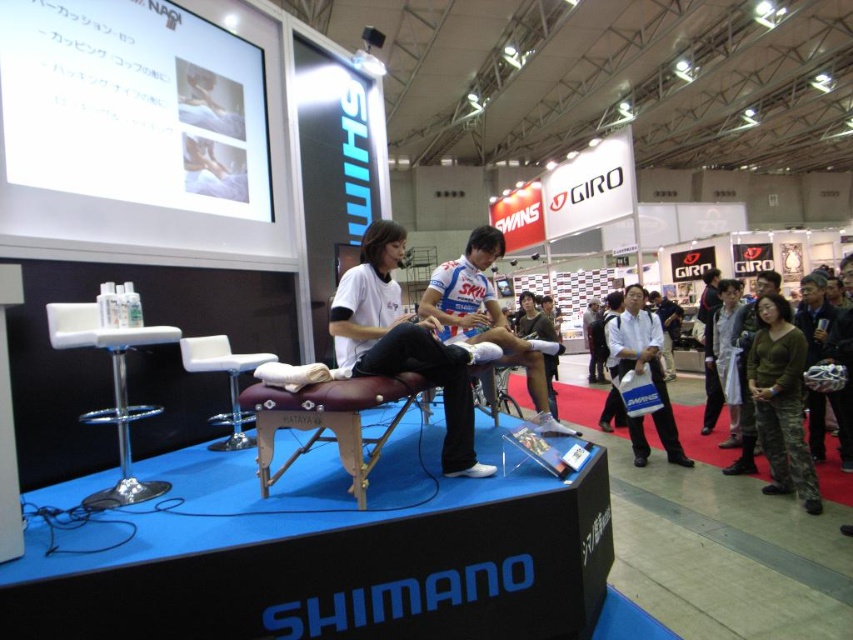
Question: Which of the following is the closest to the observer?

Choices:
 (A) (386, 403)
 (B) (469, 476)
 (C) (608, 342)

Answer: (A)

Question: Which object is farther from the camera taking this photo?

Choices:
 (A) white fabric cycling jersey at center
 (B) brown leather stool at center
 (C) white leather stool at center

Answer: (C)

Question: Which object appears farthest from the camera in this image?

Choices:
 (A) green camouflage pants at lower right
 (B) white leather stool at center
 (C) white matte bag at center
 (D) matte white shirt at center

Answer: (C)

Question: Does white fabric cycling jersey at center appear over white plastic stool at left?

Choices:
 (A) yes
 (B) no

Answer: (A)

Question: Is matte white shirt at center to the right of white leather stool at center from the viewer's perspective?

Choices:
 (A) no
 (B) yes

Answer: (B)

Question: Can you confirm if green camouflage pants at lower right is positioned below white fabric cycling jersey at center?

Choices:
 (A) yes
 (B) no

Answer: (A)